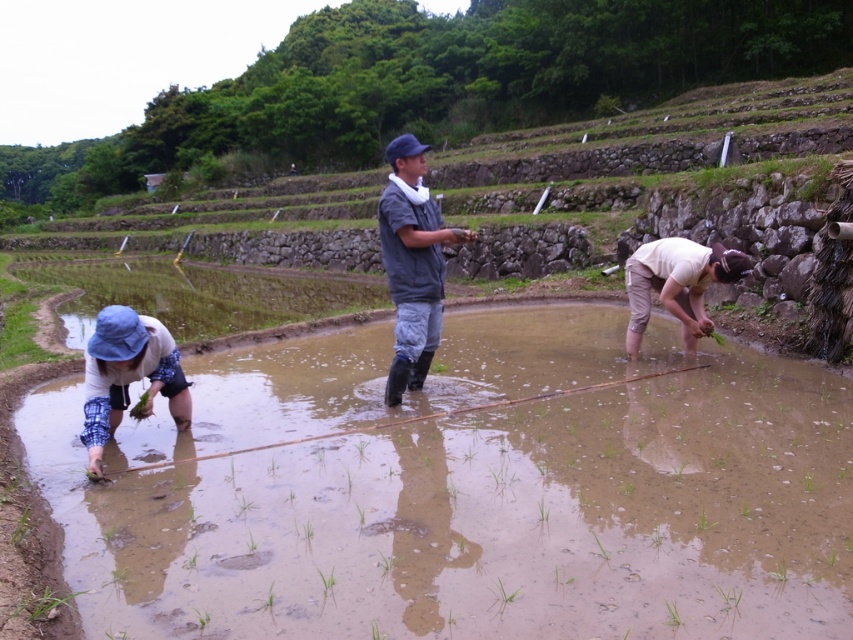
You are a photographer standing at the top of the terraced paddy fields. You want to take a photo that includes both the point at location (405, 300) and the point at (126, 401). Which point will appear closer to the bottom edge of your camera frame?

Point (126, 401) will appear closer to the bottom edge of the camera frame because it is closer to the camera compared to point (405, 300), which is further away.

You are a farmer working in the rice paddy field. You notice a brown muddy puddle at lower left and a blue fabric hat at lower left. Which object is larger in size?

The brown muddy puddle at lower left is smaller than the blue fabric hat at lower left, so the blue fabric hat at lower left is larger in size.

You are standing in the paddy field and notice two items in the distance. One is the blue fabric hat at lower left worn by a farmer, and the other is the light beige fabric at lower right. Which item appears nearer to you?

The blue fabric hat at lower left is closer to the viewer than the light beige fabric at lower right, so the blue fabric hat at lower left appears nearer to you.